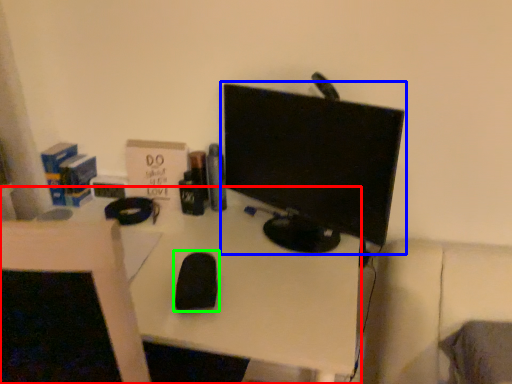
Question: Estimate the real-world distances between objects in this image. Which object is closer to desk (highlighted by a red box), computer monitor (highlighted by a blue box) or mouse (highlighted by a green box)?

Choices:
 (A) computer monitor
 (B) mouse

Answer: (B)